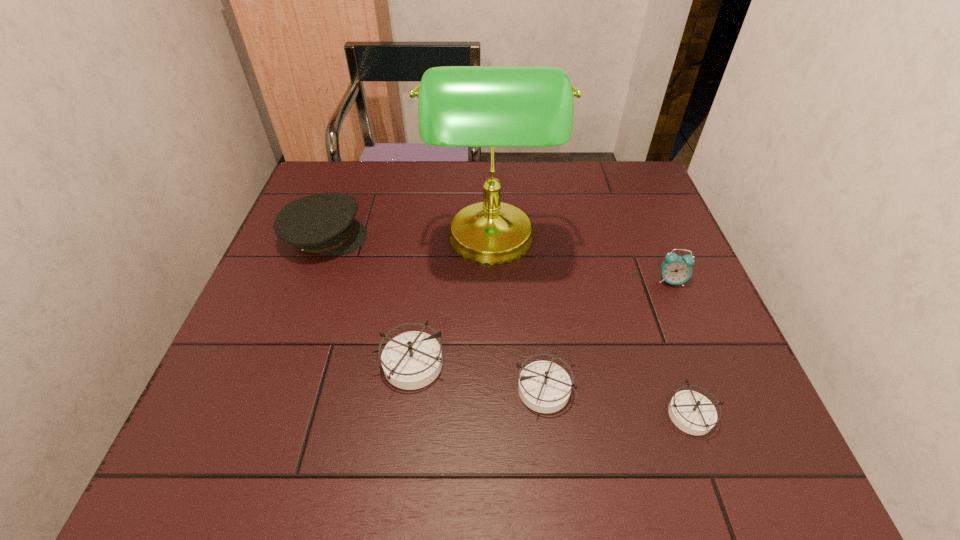
At what (x,y) coordinates should I click in order to perform the action: click on free spot located 0.350m on the left of the shortest compass. Please return your answer as a coordinate pair (x, y). The image size is (960, 540). Looking at the image, I should click on (478, 414).

What are the coordinates of `vacant position located on the desk next to the tallest object` in the screenshot? It's located at (296, 242).

At what (x,y) coordinates should I click in order to perform the action: click on free space located on the desk next to the tallest object. Please return your answer as a coordinate pair (x, y). This screenshot has height=540, width=960. Looking at the image, I should click on (333, 242).

Locate an element on the screen. The width and height of the screenshot is (960, 540). vacant region located on the desk next to the tallest object is located at coordinates (341, 242).

The image size is (960, 540). In order to click on free space located on the front-facing side of the beret in this screenshot , I will do `click(434, 237)`.

Where is `vacant space located on the face of the alarm clock`? The height and width of the screenshot is (540, 960). vacant space located on the face of the alarm clock is located at coordinates (716, 390).

You are a GUI agent. You are given a task and a screenshot of the screen. Output one action in this format:
    pyautogui.click(x=<x>, y=<y>)
    Task: Click on the object located at the left edge
    
    Given the screenshot: What is the action you would take?
    pyautogui.click(x=323, y=223)

Image resolution: width=960 pixels, height=540 pixels. Find the location of `compass positioned at the right edge`. compass positioned at the right edge is located at coordinates [693, 413].

You are a GUI agent. You are given a task and a screenshot of the screen. Output one action in this format:
    pyautogui.click(x=<x>, y=<y>)
    Task: Click on the alarm clock that is at the right edge
    
    Given the screenshot: What is the action you would take?
    pyautogui.click(x=675, y=269)

You are a GUI agent. You are given a task and a screenshot of the screen. Output one action in this format:
    pyautogui.click(x=<x>, y=<y>)
    Task: Click on the object present at the near right corner
    The width and height of the screenshot is (960, 540).
    Given the screenshot: What is the action you would take?
    pyautogui.click(x=693, y=413)